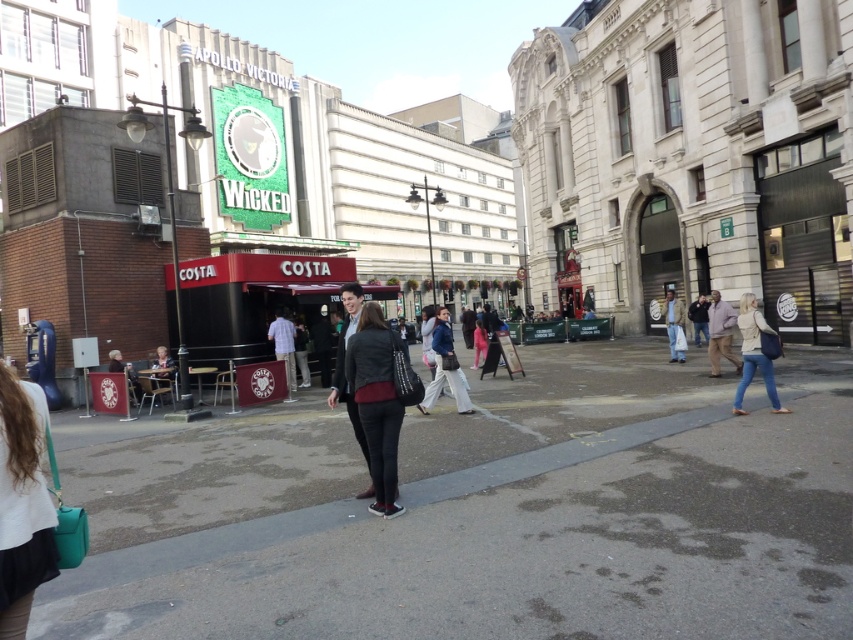
Question: In this image, where is matte black costa coffee shop at center located relative to light beige sweater at lower right?

Choices:
 (A) below
 (B) above

Answer: (B)

Question: From the image, what is the correct spatial relationship of matte black costa coffee shop at center in relation to denim jacket at center?

Choices:
 (A) above
 (B) below

Answer: (A)

Question: Which of these objects is positioned closest to the gray asphalt pavement at center?

Choices:
 (A) denim jacket at center
 (B) matte black costa coffee shop at center

Answer: (A)

Question: Is gray asphalt pavement at center further to camera compared to light beige sweater at lower right?

Choices:
 (A) yes
 (B) no

Answer: (B)

Question: Among these points, which one is farthest from the camera?

Choices:
 (A) (752, 301)
 (B) (850, 554)

Answer: (A)

Question: Which point is farther to the camera?

Choices:
 (A) matte black jacket at center
 (B) denim jacket at center

Answer: (B)